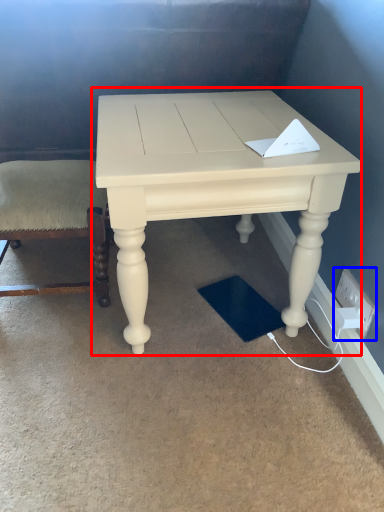
Question: Among these objects, which one is nearest to the camera, table (highlighted by a red box) or electric outlet (highlighted by a blue box)?

Choices:
 (A) table
 (B) electric outlet

Answer: (A)